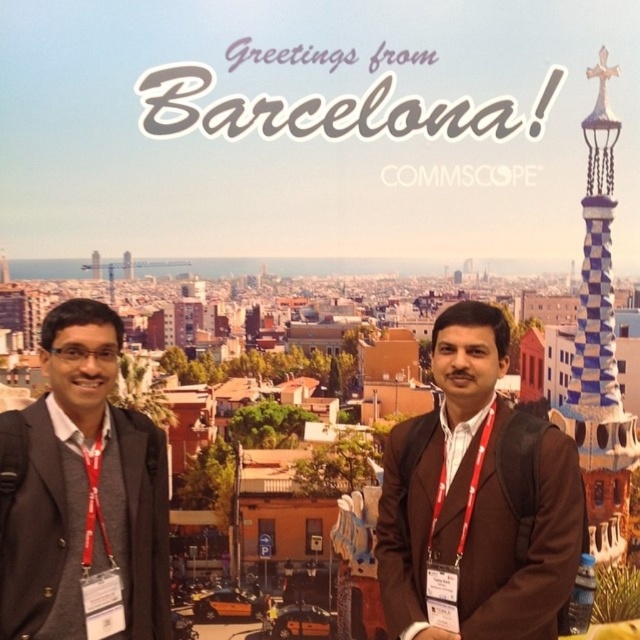
You are attending a corporate event in Barcelona and need to identify the person wearing the brown matte jacket at center. Which direction should you look relative to the dark gray suit at left?

The brown matte jacket at center is positioned over the dark gray suit at left, so you should look upward from the dark gray suit at left to locate the brown matte jacket at center.

You are a photographer who needs to adjust the lighting for a group photo. The subjects are wearing a brown matte jacket at center and a dark gray suit at left. Which clothing item requires more light to ensure it stands out against the bright Barcelona backdrop?

The brown matte jacket at center requires more light because it is bigger than the dark gray suit at left and may need additional illumination to maintain visibility against the bright backdrop.